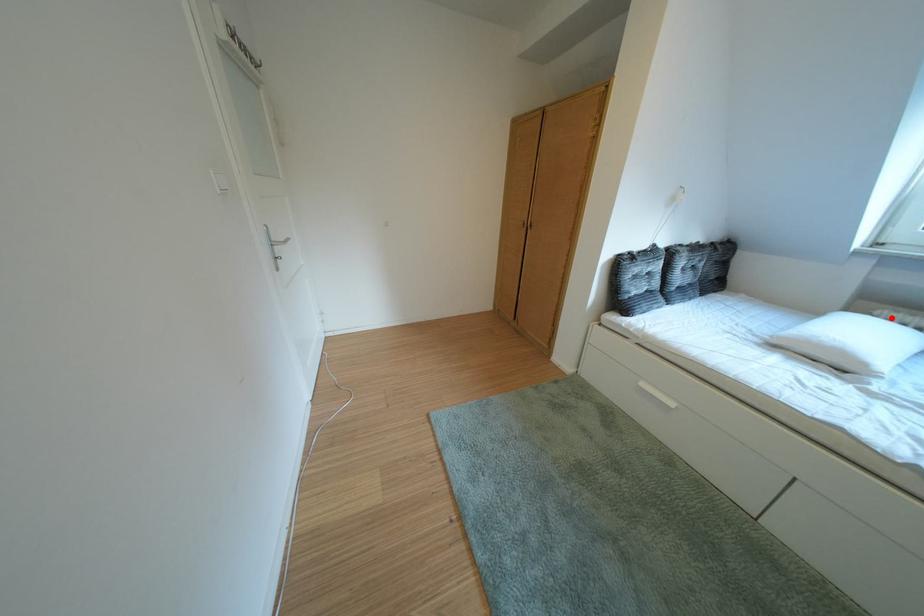
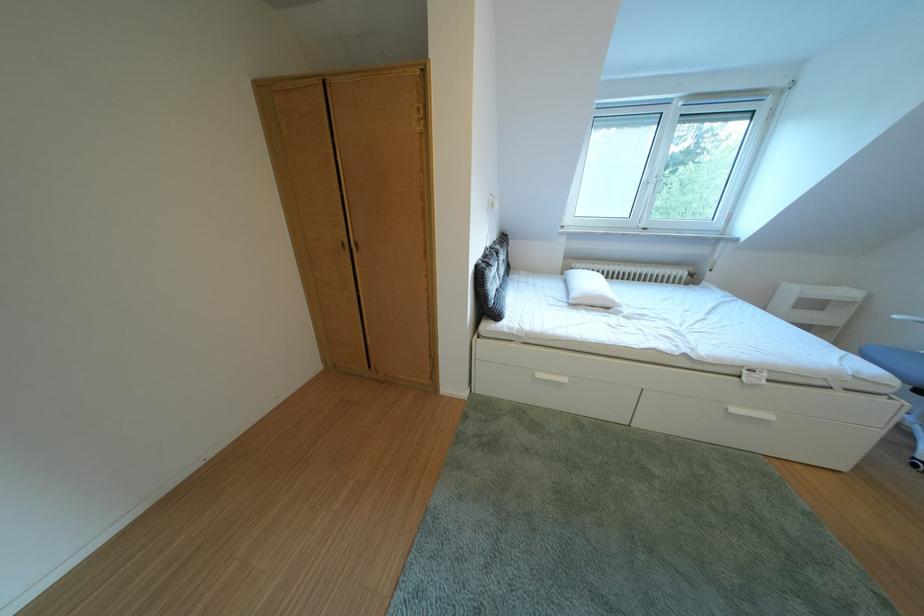
Question: I am providing you with two images of the same scene from different viewpoints. A red point is marked on the first image. At the location where the point appears in image 1, is it still visible in image 2?

Choices:
 (A) Yes
 (B) No

Answer: (A)